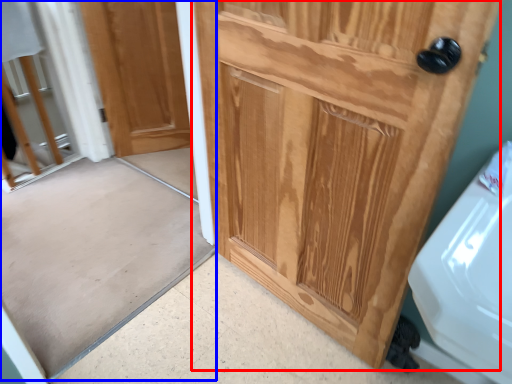
Question: Which object is closer to the camera taking this photo, door (highlighted by a red box) or screen door (highlighted by a blue box)?

Choices:
 (A) door
 (B) screen door

Answer: (A)